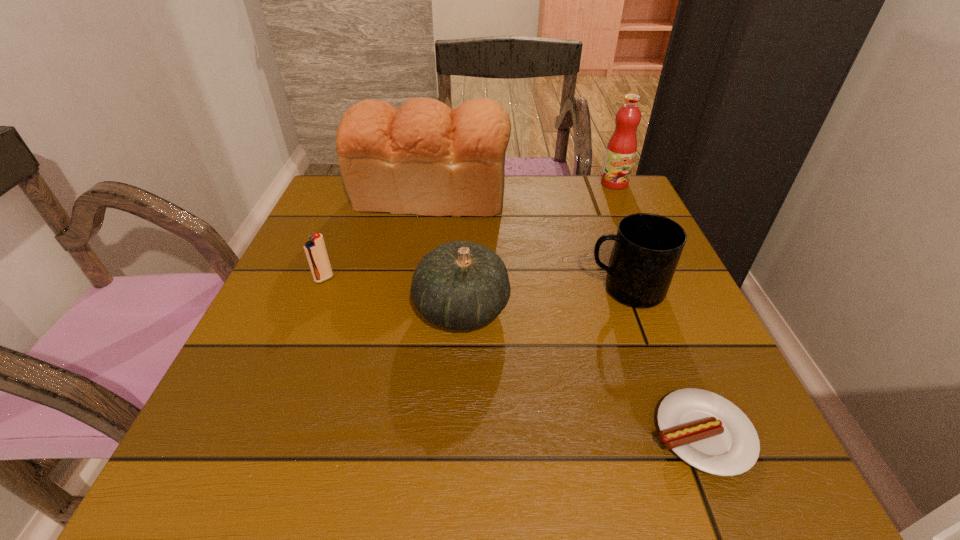
Locate an element on the screen. fruit juice that is at the right edge is located at coordinates (621, 149).

The height and width of the screenshot is (540, 960). I want to click on mug located at the right edge, so click(647, 248).

You are a GUI agent. You are given a task and a screenshot of the screen. Output one action in this format:
    pyautogui.click(x=<x>, y=<y>)
    Task: Click on the sausage present at the right edge
    The height and width of the screenshot is (540, 960).
    Given the screenshot: What is the action you would take?
    pyautogui.click(x=710, y=433)

You are a GUI agent. You are given a task and a screenshot of the screen. Output one action in this format:
    pyautogui.click(x=<x>, y=<y>)
    Task: Click on the object situated at the far left corner
    This screenshot has width=960, height=540.
    Given the screenshot: What is the action you would take?
    pyautogui.click(x=424, y=158)

Find the location of a particular element. Image resolution: width=960 pixels, height=540 pixels. object that is at the far right corner is located at coordinates (621, 149).

Where is `object located in the near right corner section of the desktop`? This screenshot has height=540, width=960. object located in the near right corner section of the desktop is located at coordinates (710, 433).

The width and height of the screenshot is (960, 540). What are the coordinates of `free space at the far edge of the desktop` in the screenshot? It's located at (557, 224).

The width and height of the screenshot is (960, 540). I want to click on free space at the near edge of the desktop, so click(x=417, y=447).

Locate an element on the screen. The width and height of the screenshot is (960, 540). free point at the left edge is located at coordinates (231, 392).

What are the coordinates of `free space at the right edge of the desktop` in the screenshot? It's located at (676, 368).